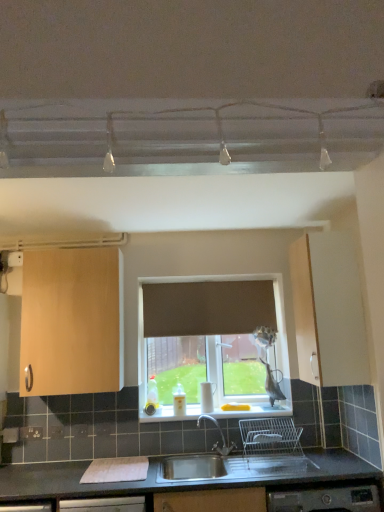
Where is `vacant area situated below brown fabric curtain at center (from a real-world perspective)`? The height and width of the screenshot is (512, 384). vacant area situated below brown fabric curtain at center (from a real-world perspective) is located at coordinates (195, 410).